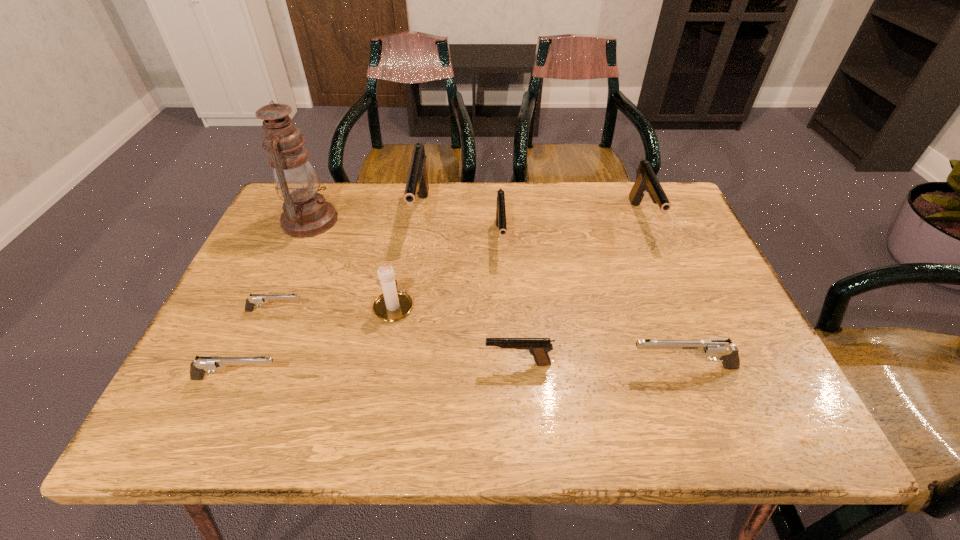
Locate an element on the screen. The image size is (960, 540). the tallest object is located at coordinates (306, 213).

You are a GUI agent. You are given a task and a screenshot of the screen. Output one action in this format:
    pyautogui.click(x=<x>, y=<y>)
    Task: Click on the leftmost black pistol
    The height and width of the screenshot is (540, 960).
    Given the screenshot: What is the action you would take?
    pyautogui.click(x=417, y=183)

This screenshot has width=960, height=540. Identify the location of the tallest pistol. (417, 183).

What are the coordinates of `the second biggest black pistol` in the screenshot? It's located at (646, 181).

This screenshot has width=960, height=540. Identify the location of the rightmost black pistol. (646, 181).

In order to click on white candle holder in this screenshot , I will do 392,305.

What are the coordinates of `the fifth shortest object` in the screenshot? It's located at (500, 207).

Where is `the third biggest black pistol`? This screenshot has height=540, width=960. the third biggest black pistol is located at coordinates (500, 207).

Identify the location of the second farthest silver pistol. (721, 347).

Locate an element on the screen. The height and width of the screenshot is (540, 960). the biggest silver pistol is located at coordinates (721, 347).